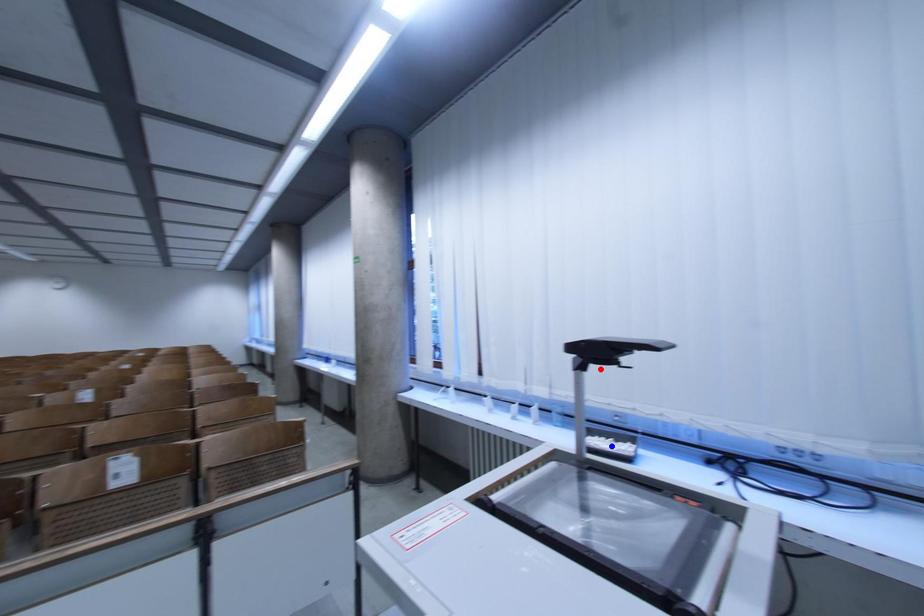
Question: Two points are marked on the image. Which point is closer to the camera?

Choices:
 (A) Blue point is closer.
 (B) Red point is closer.

Answer: (B)